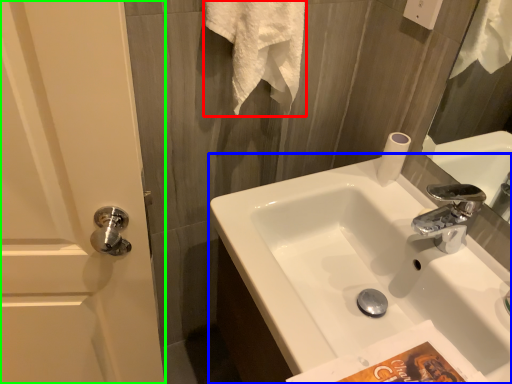
Question: Based on their relative distances, which object is nearer to bath towel (highlighted by a red box)? Choose from sink (highlighted by a blue box) and screen door (highlighted by a green box).

Choices:
 (A) sink
 (B) screen door

Answer: (A)